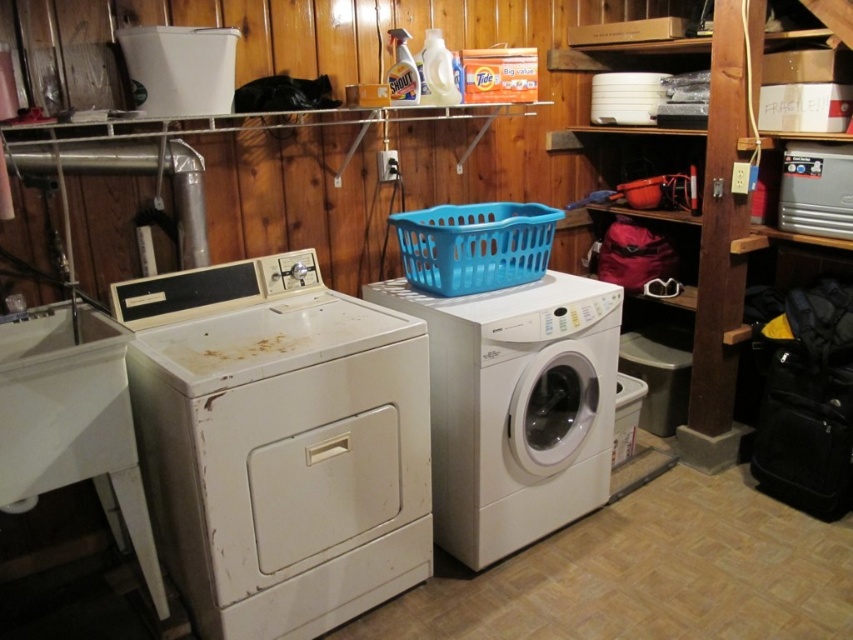
Based on the photo, between white glossy washing machine at center and blue plastic basket at center, which one appears on the right side from the viewer's perspective?

white glossy washing machine at center is more to the right.

Is white glossy washing machine at center below blue plastic basket at center?

Yes, white glossy washing machine at center is below blue plastic basket at center.

Locate an element on the screen. white glossy washing machine at center is located at coordinates (515, 406).

Is point (195, 426) in front of point (457, 509)?

Yes, point (195, 426) is in front of point (457, 509).

Is point (339, 413) in front of point (466, 508)?

Yes, it is.

The height and width of the screenshot is (640, 853). In order to click on white matte washing machine at left in this screenshot , I will do `click(277, 444)`.

From the picture: Is white matte washing machine at left smaller than blue plastic basket at center?

No.

Which is behind, point (360, 435) or point (410, 236)?

The point (410, 236) is behind.

Between point (345, 348) and point (440, 253), which one is positioned behind?

The point (440, 253) is more distant.

Locate an element on the screen. Image resolution: width=853 pixels, height=640 pixels. white matte washing machine at left is located at coordinates (277, 444).